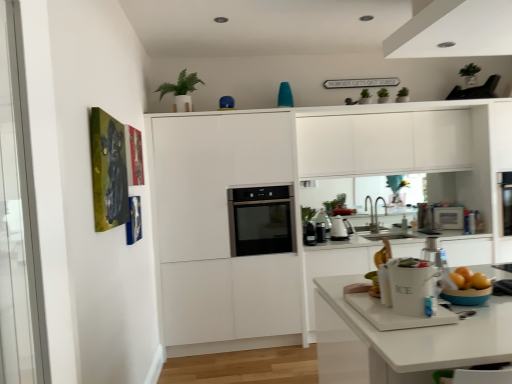
Question: Can you confirm if silver metallic faucet at center is wider than white ceramic ice bucket at lower center?

Choices:
 (A) no
 (B) yes

Answer: (B)

Question: Does silver metallic faucet at center appear on the right side of white ceramic ice bucket at lower center?

Choices:
 (A) yes
 (B) no

Answer: (A)

Question: Considering the relative sizes of silver metallic faucet at center and white ceramic ice bucket at lower center in the image provided, is silver metallic faucet at center shorter than white ceramic ice bucket at lower center?

Choices:
 (A) no
 (B) yes

Answer: (A)

Question: Is silver metallic faucet at center bigger than white ceramic ice bucket at lower center?

Choices:
 (A) yes
 (B) no

Answer: (A)

Question: Is silver metallic faucet at center positioned before white ceramic ice bucket at lower center?

Choices:
 (A) yes
 (B) no

Answer: (B)

Question: Considering their positions, is black matte coffee maker at center, the 3th appliance positioned from the back, located in front of or behind black glass oven at center?

Choices:
 (A) behind
 (B) front

Answer: (A)

Question: From the image's perspective, relative to black glass oven at center, is black matte coffee maker at center, the 3th appliance positioned from the back, above or below?

Choices:
 (A) above
 (B) below

Answer: (B)

Question: Is black matte coffee maker at center, arranged as the 2th appliance when viewed from the front, situated inside black glass oven at center or outside?

Choices:
 (A) inside
 (B) outside

Answer: (B)

Question: From their relative heights in the image, would you say black matte coffee maker at center, arranged as the 2th appliance when viewed from the left, is taller or shorter than black glass oven at center?

Choices:
 (A) tall
 (B) short

Answer: (B)

Question: Would you say green matte plant at upper center is to the left or to the right of black plastic coffee maker at center, acting as the 4th appliance starting from the right, in the picture?

Choices:
 (A) left
 (B) right

Answer: (A)

Question: From their relative heights in the image, would you say green matte plant at upper center is taller or shorter than black plastic coffee maker at center, acting as the 4th appliance starting from the right?

Choices:
 (A) short
 (B) tall

Answer: (B)

Question: Is green matte plant at upper center situated inside black plastic coffee maker at center, the first appliance from the front, or outside?

Choices:
 (A) inside
 (B) outside

Answer: (B)

Question: Relative to black plastic coffee maker at center, placed as the fourth appliance when sorted from back to front, is green matte plant at upper center in front or behind?

Choices:
 (A) front
 (B) behind

Answer: (A)

Question: Based on their sizes in the image, would you say white ceramic ice bucket at lower center is bigger or smaller than white glossy kettle at center, which ranks as the third appliance in left-to-right order?

Choices:
 (A) big
 (B) small

Answer: (B)

Question: From a real-world perspective, is white ceramic ice bucket at lower center physically located above or below white glossy kettle at center, arranged as the 3th appliance when viewed from the front?

Choices:
 (A) below
 (B) above

Answer: (B)